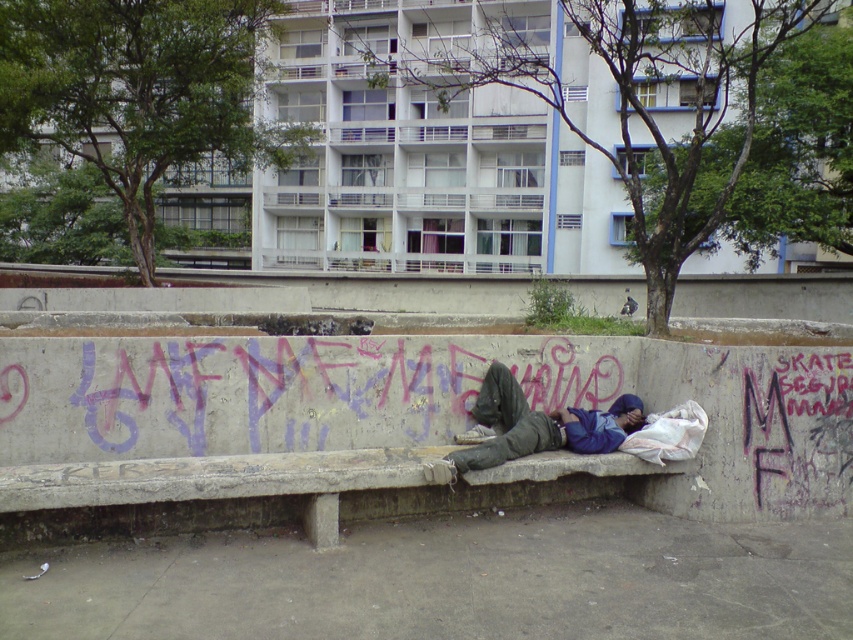
Question: Which point is closer to the camera?

Choices:
 (A) concrete bench at center
 (B) blue fleece jacket at center

Answer: (A)

Question: Can you confirm if concrete bench at center is positioned above blue fleece jacket at center?

Choices:
 (A) no
 (B) yes

Answer: (A)

Question: Which point is farther to the camera?

Choices:
 (A) (567, 422)
 (B) (254, 483)

Answer: (A)

Question: Is concrete bench at center below blue fleece jacket at center?

Choices:
 (A) no
 (B) yes

Answer: (B)

Question: Does concrete bench at center come in front of blue fleece jacket at center?

Choices:
 (A) no
 (B) yes

Answer: (B)